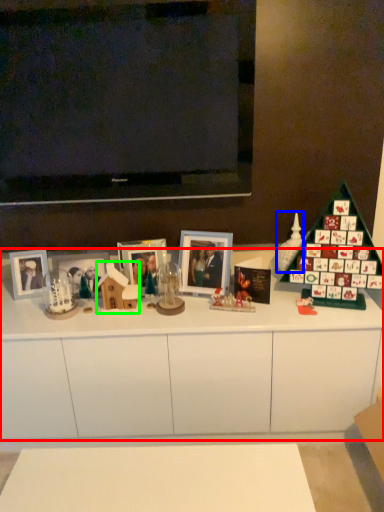
Question: Which object is positioned closest to cabinetry (highlighted by a red box)? Select from toy (highlighted by a blue box) and toy (highlighted by a green box).

Choices:
 (A) toy
 (B) toy

Answer: (B)